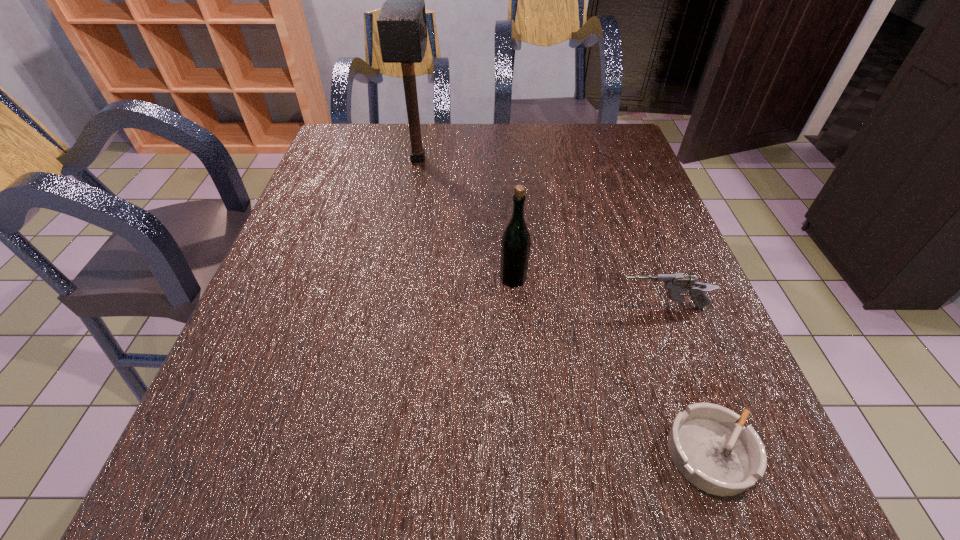
Locate an element on the screen. The height and width of the screenshot is (540, 960). free space in the image that satisfies the following two spatial constraints: 1. on the front side of the farthest object; 2. on the right side of the beer bottle is located at coordinates (396, 279).

Identify the location of free point that satisfies the following two spatial constraints: 1. at the barrel of the third tallest object; 2. on the front side of the ashtray. (715, 453).